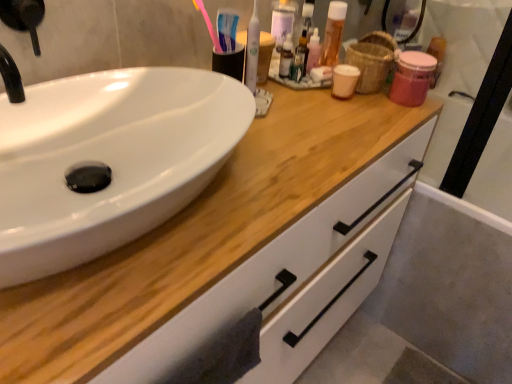
Identify the location of vacant point to the right of white plastic toothbrush at upper center, the first mouthwash positioned from the front. The image size is (512, 384). (321, 109).